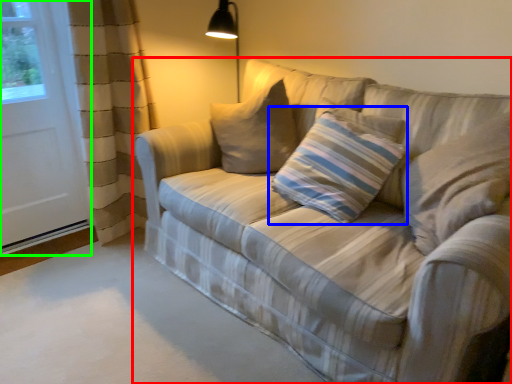
Question: Estimate the real-world distances between objects in this image. Which object is farther from studio couch (highlighted by a red box), pillow (highlighted by a blue box) or screen door (highlighted by a green box)?

Choices:
 (A) pillow
 (B) screen door

Answer: (B)